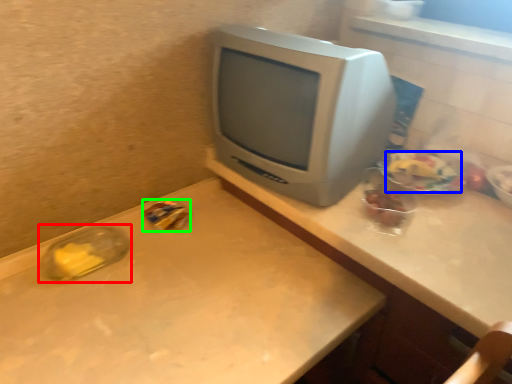
Question: Estimate the real-world distances between objects in this image. Which object is farther from glass jar (highlighted by a red box), food (highlighted by a blue box) or food (highlighted by a green box)?

Choices:
 (A) food
 (B) food

Answer: (A)